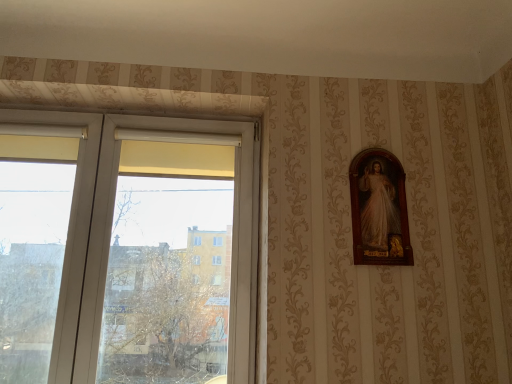
You are a GUI agent. You are given a task and a screenshot of the screen. Output one action in this format:
    pyautogui.click(x=<x>, y=<y>)
    Task: Click on the transparent glass window at left
    
    Given the screenshot: What is the action you would take?
    pyautogui.click(x=111, y=228)

Describe the element at coordinates (111, 228) in the screenshot. The image size is (512, 384). I see `transparent glass window at left` at that location.

In order to face transparent glass window at left, should I rotate leftwards or rightwards?

Rotate your view left by about 19.223°.

What do you see at coordinates (379, 210) in the screenshot?
I see `wooden frame at right` at bounding box center [379, 210].

Identify the location of wooden frame at right. The width and height of the screenshot is (512, 384). (379, 210).

Where is `transparent glass window at left`? transparent glass window at left is located at coordinates (111, 228).

Is wooden frame at right to the left of transparent glass window at left from the viewer's perspective?

No, wooden frame at right is not to the left of transparent glass window at left.

Considering the relative positions of wooden frame at right and transparent glass window at left in the image provided, is wooden frame at right in front of transparent glass window at left?

Answer: No, it is not.

Considering the points (394, 195) and (127, 128), which point is in front, point (394, 195) or point (127, 128)?

The point (394, 195) is closer to the camera.

From the image's perspective, between wooden frame at right and transparent glass window at left, which one is located above?

wooden frame at right.

From a real-world perspective, between wooden frame at right and transparent glass window at left, who is vertically lower?

From a 3D spatial view, transparent glass window at left is below.

Looking at their sizes, would you say wooden frame at right is wider or thinner than transparent glass window at left?

wooden frame at right is thinner than transparent glass window at left.

Can you confirm if wooden frame at right is taller than transparent glass window at left?

No.

Is wooden frame at right bigger or smaller than transparent glass window at left?

Clearly, wooden frame at right is smaller in size than transparent glass window at left.

Is wooden frame at right positioned beyond the bounds of transparent glass window at left?

Yes, wooden frame at right is not within transparent glass window at left.

Is wooden frame at right next to transparent glass window at left?

No, wooden frame at right is not touching transparent glass window at left.

Is transparent glass window at left at the back of wooden frame at right?

No, wooden frame at right is not facing away from transparent glass window at left.

What's the angular difference between wooden frame at right and transparent glass window at left's facing directions?

The angular difference between wooden frame at right and transparent glass window at left is 0.811 degrees.

Locate an element on the screen. window that appears below the wooden frame at right (from a real-world perspective) is located at coordinates (111, 228).

Considering the positions of objects transparent glass window at left and wooden frame at right in the image provided, who is more to the right, transparent glass window at left or wooden frame at right?

wooden frame at right.

Is transparent glass window at left positioned in front of wooden frame at right?

Yes, transparent glass window at left is in front of wooden frame at right.

Is point (58, 327) closer to camera compared to point (350, 165)?

That is True.

From the image's perspective, between transparent glass window at left and wooden frame at right, who is located below?

From the image's view, transparent glass window at left is below.

From a real-world perspective, is transparent glass window at left on top of wooden frame at right?

Actually, transparent glass window at left is physically below wooden frame at right in the real world.

Can you confirm if transparent glass window at left is wider than wooden frame at right?

Yes, transparent glass window at left is wider than wooden frame at right.

Which of these two, transparent glass window at left or wooden frame at right, stands shorter?

Standing shorter between the two is wooden frame at right.

Is transparent glass window at left bigger or smaller than wooden frame at right?

In the image, transparent glass window at left appears to be larger than wooden frame at right.

Consider the image. Is transparent glass window at left outside of wooden frame at right?

Yes, transparent glass window at left is not within wooden frame at right.

Is transparent glass window at left directly adjacent to wooden frame at right?

No.

Is transparent glass window at left facing towards wooden frame at right?

No, transparent glass window at left is not turned towards wooden frame at right.

I want to click on picture frame behind the transparent glass window at left, so click(x=379, y=210).

Identify the location of window located in front of the wooden frame at right. (111, 228).

Locate an element on the screen. window below the wooden frame at right (from the image's perspective) is located at coordinates (111, 228).